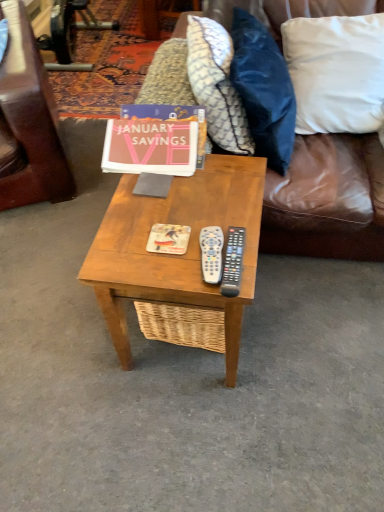
Identify the location of blank space above woodenwoodencoffee table at center (from a real-world perspective). The height and width of the screenshot is (512, 384). (183, 211).